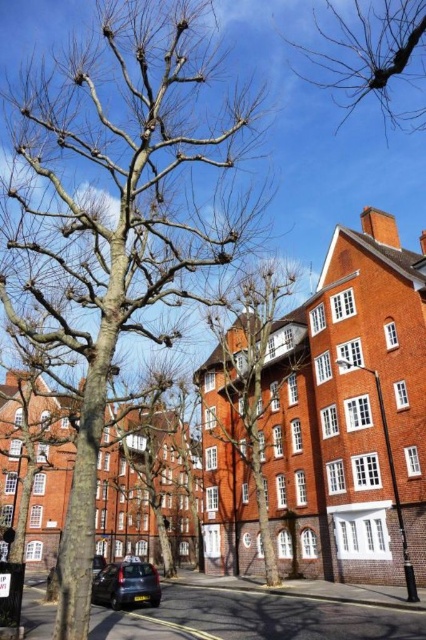
Consider the image. You are standing on the sidewalk in front of the red brick buildings. You see a bare wood tree at center and a bare branches at upper right. Which object is closer to you?

The bare wood tree at center is closer to you because it is positioned further to the viewer than the bare branches at upper right.